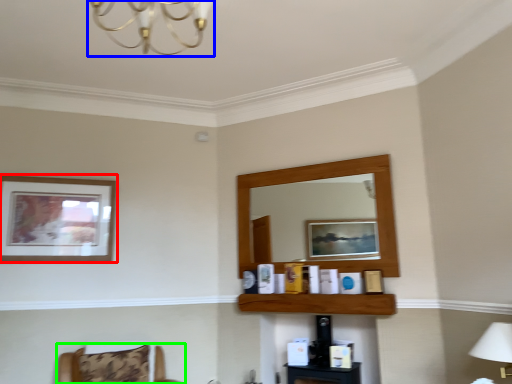
Question: Based on their relative distances, which object is farther from picture frame (highlighted by a red box)? Choose from light fixture (highlighted by a blue box) and furniture (highlighted by a green box).

Choices:
 (A) light fixture
 (B) furniture

Answer: (A)